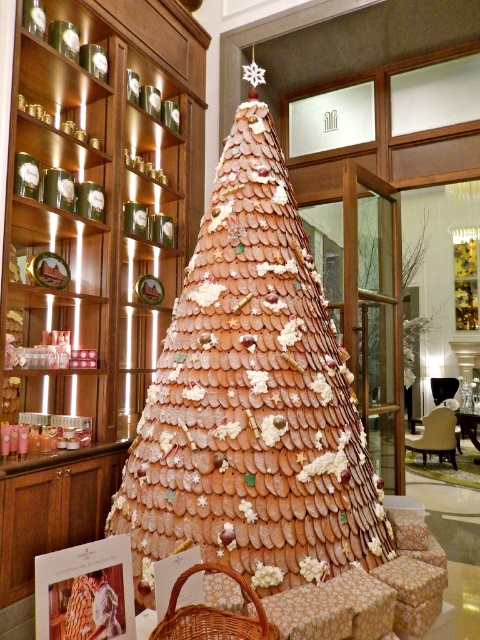
Measure the distance between cinnamon-brown gingerbread cone at center and woven brown basket at lower center.

A distance of 32.97 inches exists between cinnamon-brown gingerbread cone at center and woven brown basket at lower center.

Is point (239, 369) less distant than point (248, 588)?

No, (239, 369) is further to viewer.

This screenshot has width=480, height=640. What do you see at coordinates (252, 397) in the screenshot? I see `cinnamon-brown gingerbread cone at center` at bounding box center [252, 397].

This screenshot has height=640, width=480. I want to click on cinnamon-brown gingerbread cone at center, so click(252, 397).